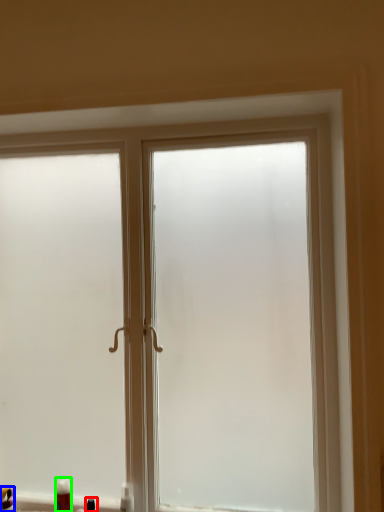
Question: Estimate the real-world distances between objects in this image. Which object is farther from toiletry (highlighted by a red box), toiletry (highlighted by a blue box) or toiletry (highlighted by a green box)?

Choices:
 (A) toiletry
 (B) toiletry

Answer: (A)